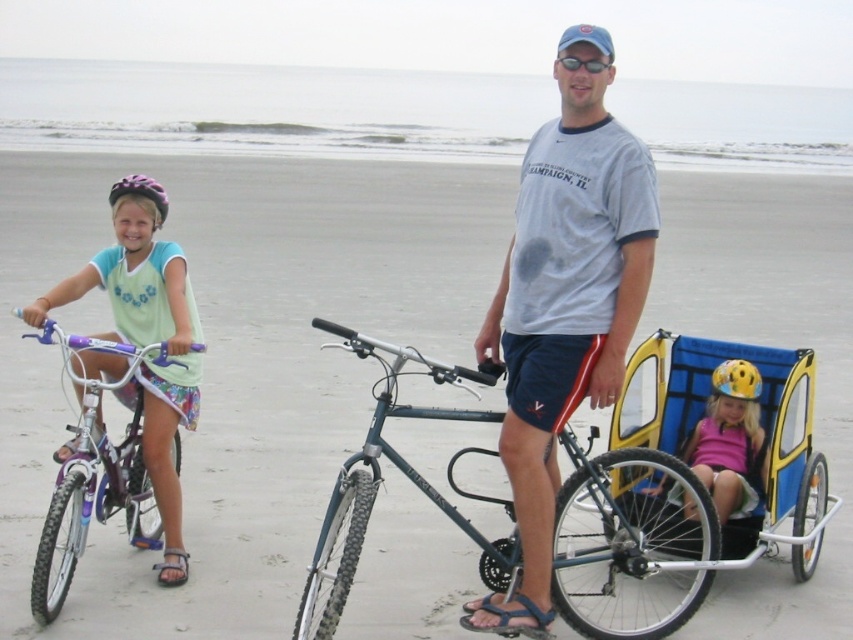
Measure the distance between gray t-shirt at center and purple matte bicycle helmet at upper left.

A distance of 5.93 meters exists between gray t-shirt at center and purple matte bicycle helmet at upper left.

Who is higher up, gray t-shirt at center or purple matte bicycle helmet at upper left?

purple matte bicycle helmet at upper left is above.

I want to click on gray t-shirt at center, so click(564, 301).

Can you confirm if blue plastic baby carriage at lower right is thinner than purple matte bicycle helmet at upper left?

Yes, blue plastic baby carriage at lower right is thinner than purple matte bicycle helmet at upper left.

Between blue plastic baby carriage at lower right and purple matte bicycle helmet at upper left, which one has less height?

Standing shorter between the two is blue plastic baby carriage at lower right.

Describe the element at coordinates (759, 422) in the screenshot. I see `blue plastic baby carriage at lower right` at that location.

Where is `blue plastic baby carriage at lower right`? The image size is (853, 640). blue plastic baby carriage at lower right is located at coordinates (759, 422).

The height and width of the screenshot is (640, 853). Identify the location of purple metallic bicycle at left. (96, 472).

Does purple metallic bicycle at left appear on the left side of purple matte bicycle helmet at upper left?

No, purple metallic bicycle at left is not to the left of purple matte bicycle helmet at upper left.

Does point (86, 451) lie in front of point (160, 212)?

Yes, point (86, 451) is closer to viewer.

This screenshot has height=640, width=853. Identify the location of purple metallic bicycle at left. (96, 472).